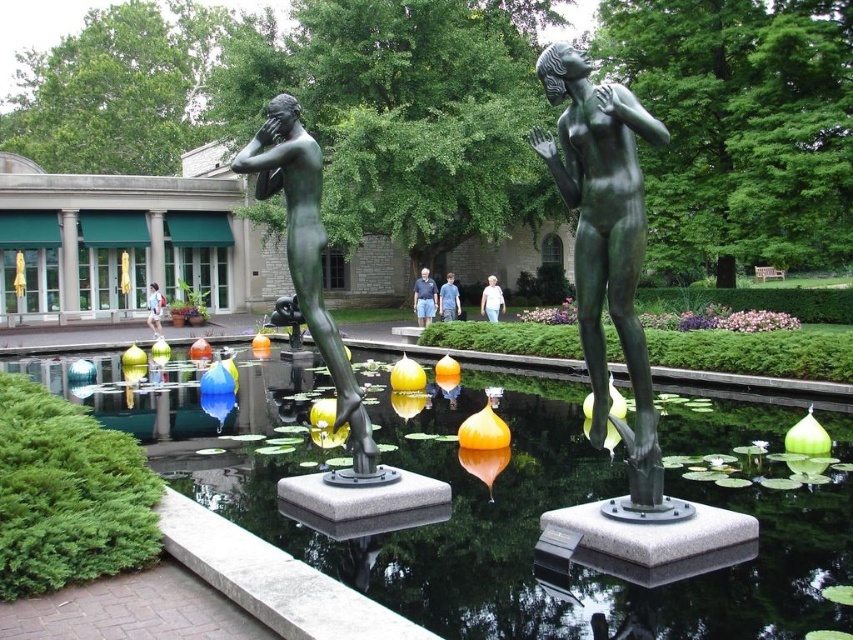
Question: In this image, where is blue jeans at center located relative to denim jacket at center?

Choices:
 (A) below
 (B) above

Answer: (B)

Question: Among these objects, which one is farthest from the camera?

Choices:
 (A) bronze statue at center
 (B) white matte shirt at center
 (C) denim jacket at center
 (D) glossy concrete pond at center

Answer: (C)

Question: Which of the following is the farthest from the observer?

Choices:
 (A) light blue jeans at center
 (B) bronze statue at center
 (C) blue jeans at center

Answer: (C)

Question: Is blue jeans at center to the left of light blue jeans at center from the viewer's perspective?

Choices:
 (A) yes
 (B) no

Answer: (A)

Question: Can you confirm if bronze statue at center is positioned to the right of denim jacket at center?

Choices:
 (A) yes
 (B) no

Answer: (A)

Question: Among these points, which one is nearest to the camera?

Choices:
 (A) (312, 324)
 (B) (442, 314)

Answer: (A)